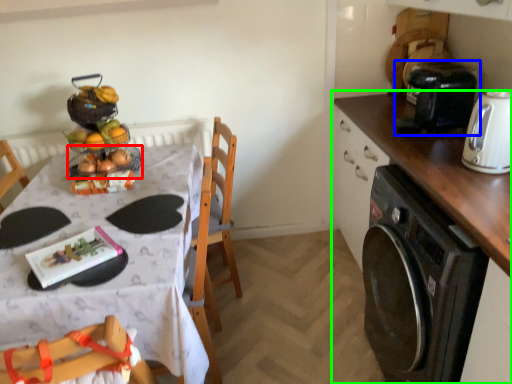
Question: Considering the real-world distances, which object is farthest from basket (highlighted by a red box)? coffee machine (highlighted by a blue box) or cabinetry (highlighted by a green box)?

Choices:
 (A) coffee machine
 (B) cabinetry

Answer: (A)